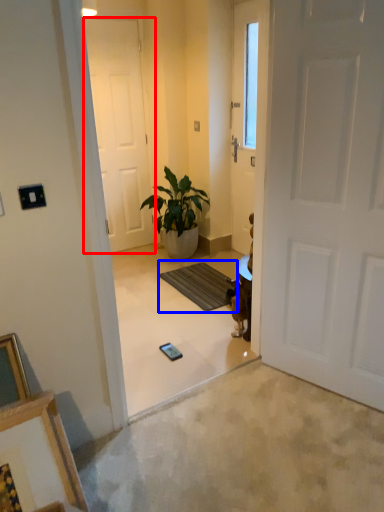
Question: Which of the following is the closest to the observer, door (highlighted by a red box) or doormat (highlighted by a blue box)?

Choices:
 (A) door
 (B) doormat

Answer: (B)